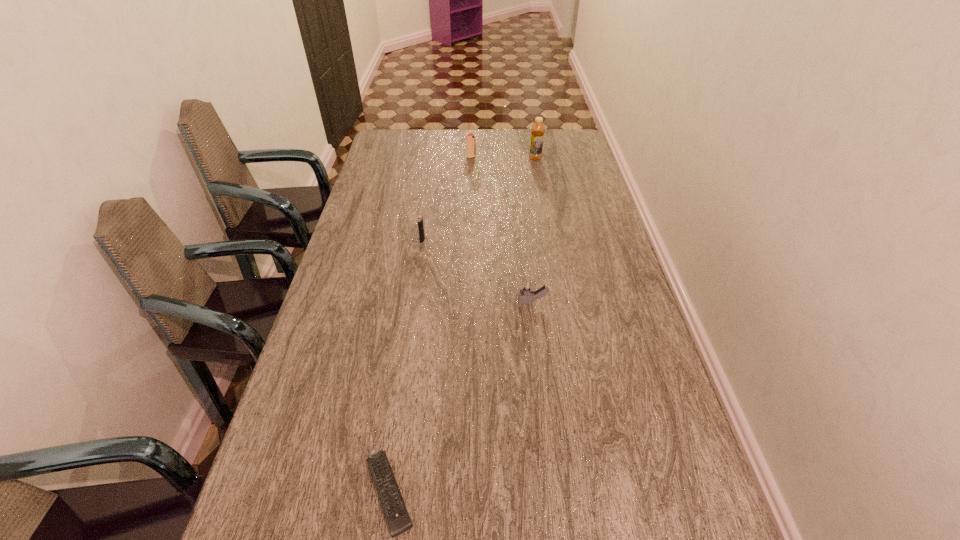
Identify the location of free space that is in between the bottle and the third nearest object. The width and height of the screenshot is (960, 540). (479, 200).

Where is `unoccupied position between the third object from right to left and the bottle`? The height and width of the screenshot is (540, 960). unoccupied position between the third object from right to left and the bottle is located at coordinates (503, 158).

You are a GUI agent. You are given a task and a screenshot of the screen. Output one action in this format:
    pyautogui.click(x=<x>, y=<y>)
    Task: Click on the vacant space in between the second igniter from right to left and the second object from right to left
    
    Given the screenshot: What is the action you would take?
    pyautogui.click(x=502, y=230)

The image size is (960, 540). I want to click on free point between the rightmost object and the second igniter from right to left, so click(x=503, y=158).

At what (x,y) coordinates should I click in order to perform the action: click on free space between the second nearest igniter and the farthest igniter. Please return your answer as a coordinate pair (x, y). Looking at the image, I should click on click(446, 199).

Locate an element on the screen. Image resolution: width=960 pixels, height=540 pixels. free spot between the rightmost object and the farthest igniter is located at coordinates pos(503,158).

Where is `vacant point located between the bottle and the rightmost igniter`? The width and height of the screenshot is (960, 540). vacant point located between the bottle and the rightmost igniter is located at coordinates (534, 231).

Where is `free space between the second object from right to left and the leftmost igniter`? The image size is (960, 540). free space between the second object from right to left and the leftmost igniter is located at coordinates (478, 272).

You are a GUI agent. You are given a task and a screenshot of the screen. Output one action in this format:
    pyautogui.click(x=<x>, y=<y>)
    Task: Click on the free space between the bottle and the leftmost igniter
    Image resolution: width=960 pixels, height=540 pixels.
    Given the screenshot: What is the action you would take?
    pyautogui.click(x=479, y=200)

Identify the location of vacant area between the farthest igniter and the remote control. Image resolution: width=960 pixels, height=540 pixels. (430, 325).